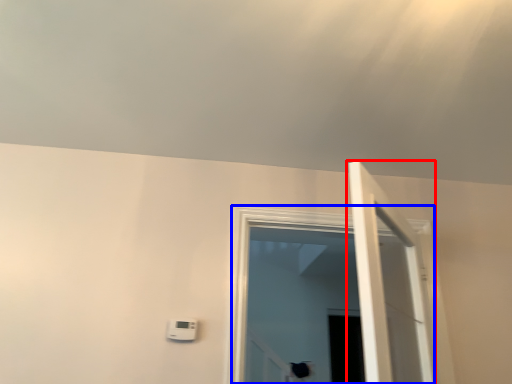
Question: Which object is closer to the camera taking this photo, door (highlighted by a red box) or window (highlighted by a blue box)?

Choices:
 (A) door
 (B) window

Answer: (A)